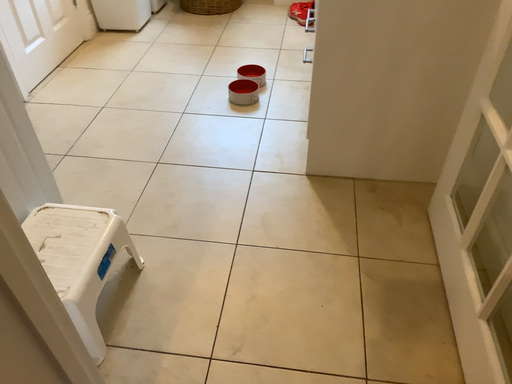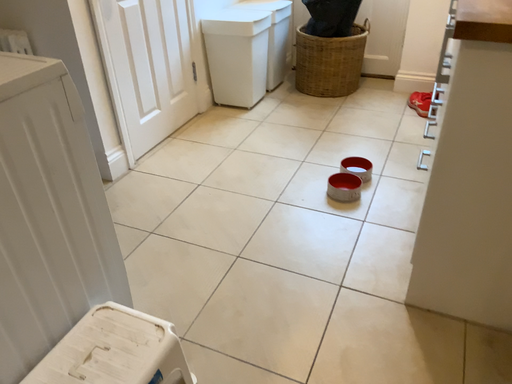
Question: Which way did the camera rotate in the video?

Choices:
 (A) rotated downward
 (B) rotated upward

Answer: (B)